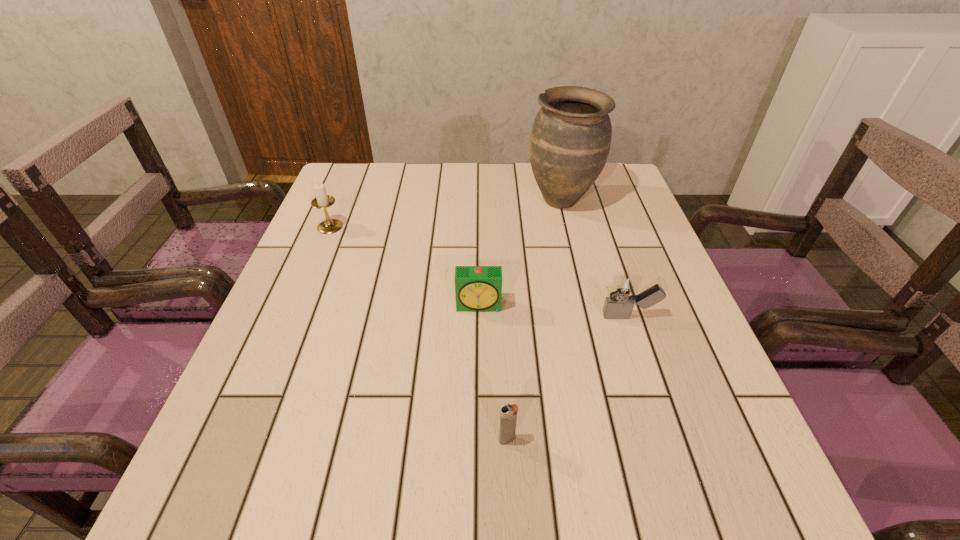
Identify the location of the tallest object. (570, 139).

Find the location of a particular element. This screenshot has width=960, height=540. candle holder is located at coordinates (322, 201).

Where is `the taller igniter`? the taller igniter is located at coordinates (623, 290).

Find the location of a particular element. The width and height of the screenshot is (960, 540). the farther igniter is located at coordinates (623, 290).

You are a GUI agent. You are given a task and a screenshot of the screen. Output one action in this format:
    pyautogui.click(x=<x>, y=<y>)
    Task: Click on the alarm clock
    
    Given the screenshot: What is the action you would take?
    pyautogui.click(x=477, y=288)

This screenshot has width=960, height=540. In order to click on the nearer igniter in this screenshot , I will do `click(508, 415)`.

At what (x,y) coordinates should I click in order to perform the action: click on the shorter igniter. Please return your answer as a coordinate pair (x, y). Image resolution: width=960 pixels, height=540 pixels. Looking at the image, I should click on (508, 415).

Where is `free space located on the right of the urn`? The width and height of the screenshot is (960, 540). free space located on the right of the urn is located at coordinates (619, 200).

You are a GUI agent. You are given a task and a screenshot of the screen. Output one action in this format:
    pyautogui.click(x=<x>, y=<y>)
    Task: Click on the vacant space located on the front of the leftmost object
    The image size is (960, 540).
    Given the screenshot: What is the action you would take?
    pyautogui.click(x=315, y=263)

Identify the location of free space located 0.380m on the left of the farther igniter. This screenshot has height=540, width=960. (418, 316).